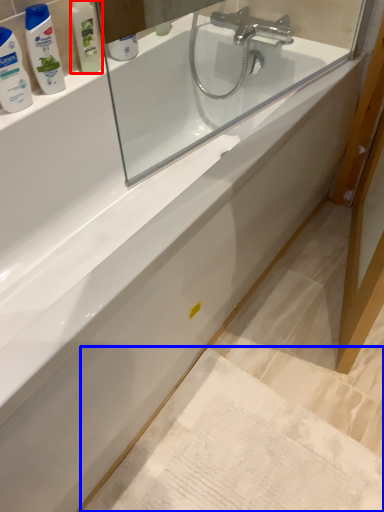
Question: Among these objects, which one is farthest to the camera, toiletry (highlighted by a red box) or bath mat (highlighted by a blue box)?

Choices:
 (A) toiletry
 (B) bath mat

Answer: (A)